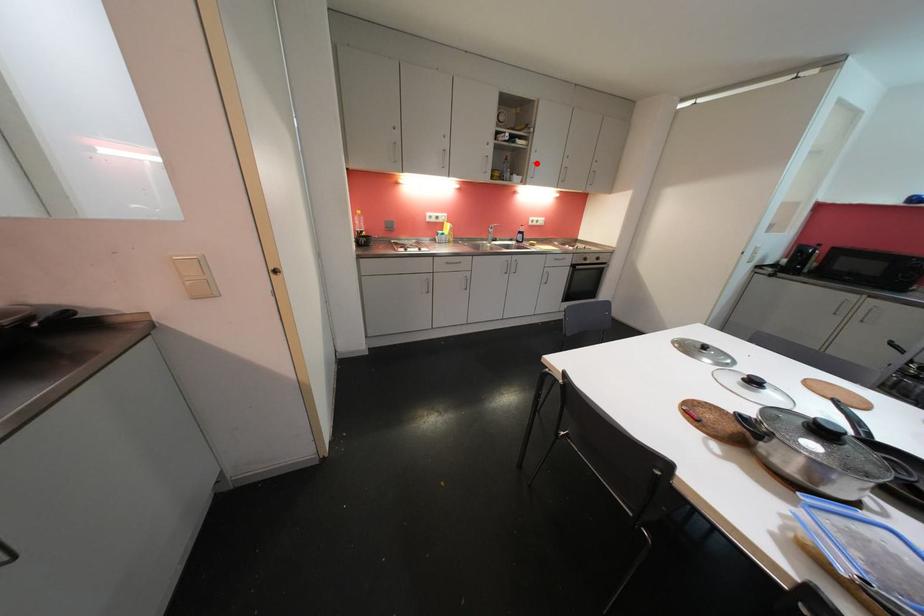
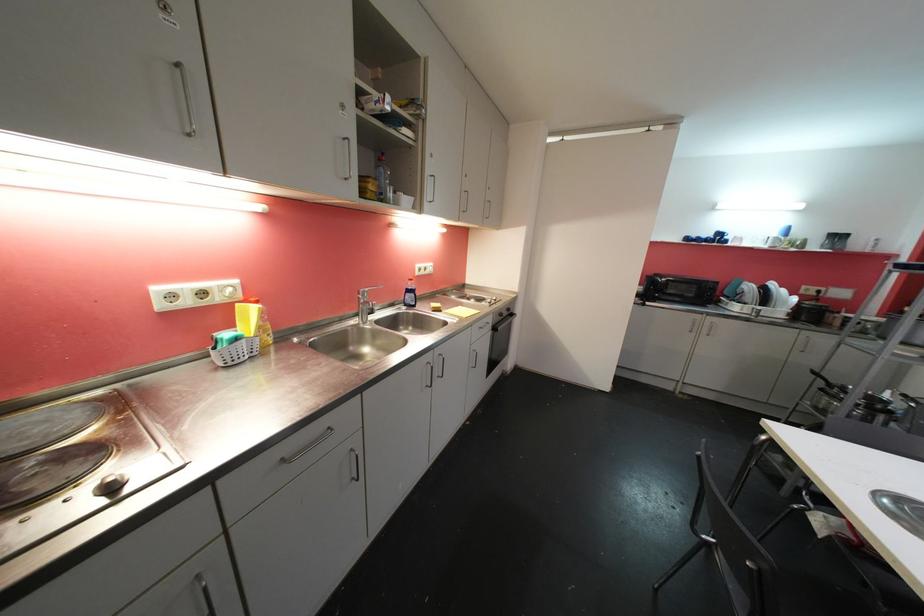
Where in the second image is the point corresponding to the highlighted location from the first image?

(432, 174)